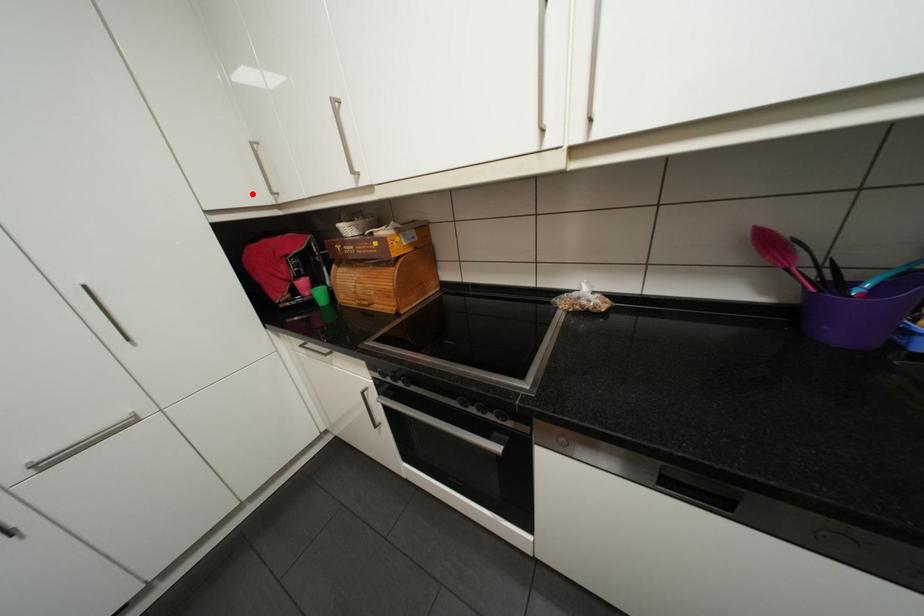
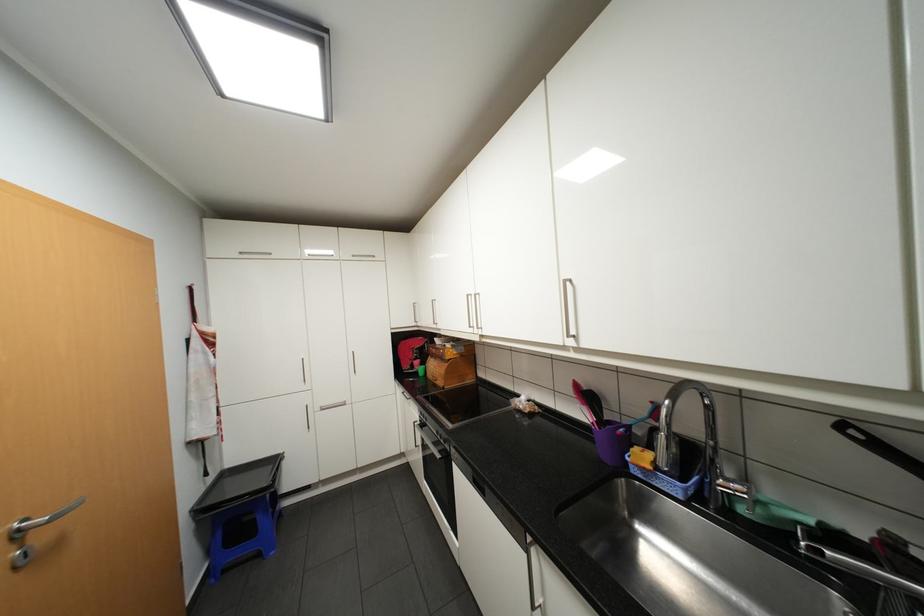
In the second image, find the point that corresponds to the highlighted location in the first image.

(412, 322)